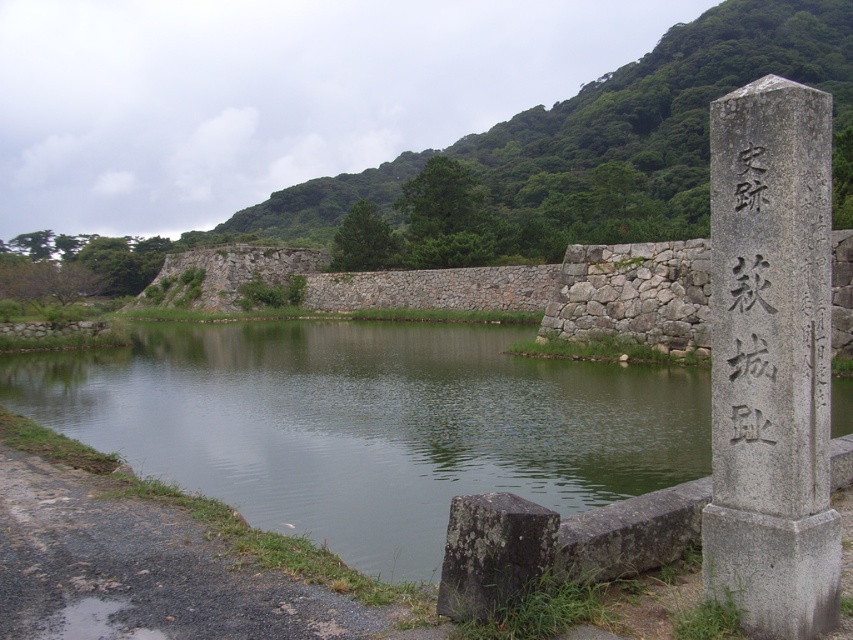
Question: Which of the following is the closest to the observer?

Choices:
 (A) (740, 262)
 (B) (821, 346)

Answer: (B)

Question: Is green stone river at center positioned in front of black stone writing at right?

Choices:
 (A) yes
 (B) no

Answer: (B)

Question: Does green stone river at center have a lesser width compared to black stone writing at right?

Choices:
 (A) yes
 (B) no

Answer: (B)

Question: Can you confirm if gray stone pillar at right is smaller than black stone writing at right?

Choices:
 (A) no
 (B) yes

Answer: (A)

Question: Among these points, which one is farthest from the camera?

Choices:
 (A) (746, 188)
 (B) (747, 268)

Answer: (B)

Question: Considering the real-world distances, which object is farthest from the green stone river at center?

Choices:
 (A) black stone writing at right
 (B) gray stone pillar at right

Answer: (A)